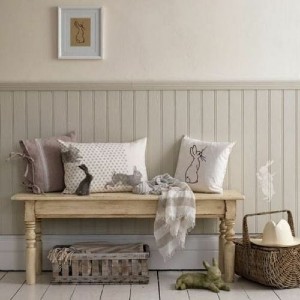
At what (x,y) coordinates should I click in order to perform the action: click on gray pillow with tie sides. Please return your answer as a coordinate pair (x, y). This screenshot has width=300, height=300. Looking at the image, I should click on (53, 170).